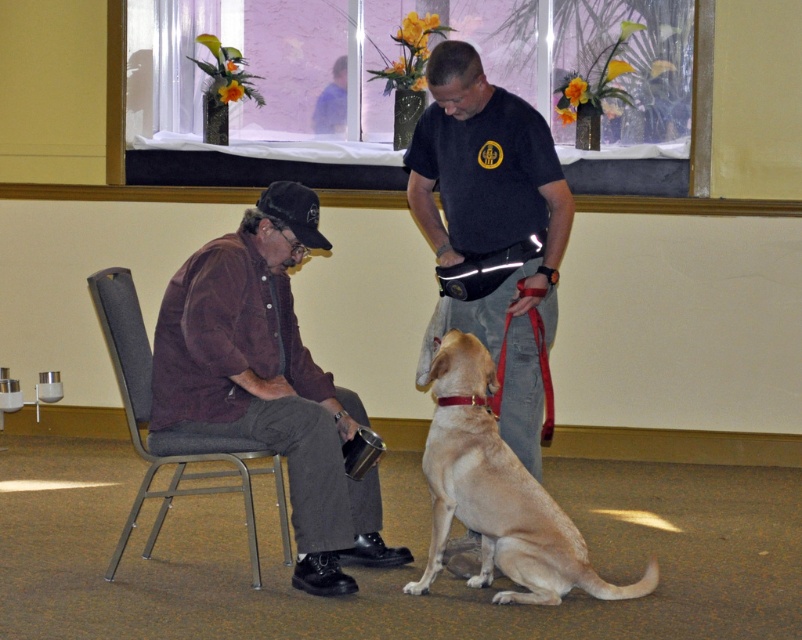
Question: Can you confirm if light brown fur at center is positioned to the left of gray fabric chair at left?

Choices:
 (A) no
 (B) yes

Answer: (A)

Question: Which object is the closest to the brown suede shirt at left?

Choices:
 (A) gray fabric chair at left
 (B) light brown fur at center

Answer: (A)

Question: Which object appears closest to the camera in this image?

Choices:
 (A) brown suede shirt at left
 (B) gray fabric chair at left
 (C) light brown fur at center

Answer: (C)

Question: Based on their relative distances, which object is nearer to the dark gray t-shirt at center?

Choices:
 (A) brown suede shirt at left
 (B) gray fabric chair at left
 (C) light brown fur at center

Answer: (C)

Question: Where is light brown fur at center located in relation to gray fabric chair at left in the image?

Choices:
 (A) above
 (B) below

Answer: (B)

Question: Does dark gray t-shirt at center lie in front of gray fabric chair at left?

Choices:
 (A) no
 (B) yes

Answer: (A)